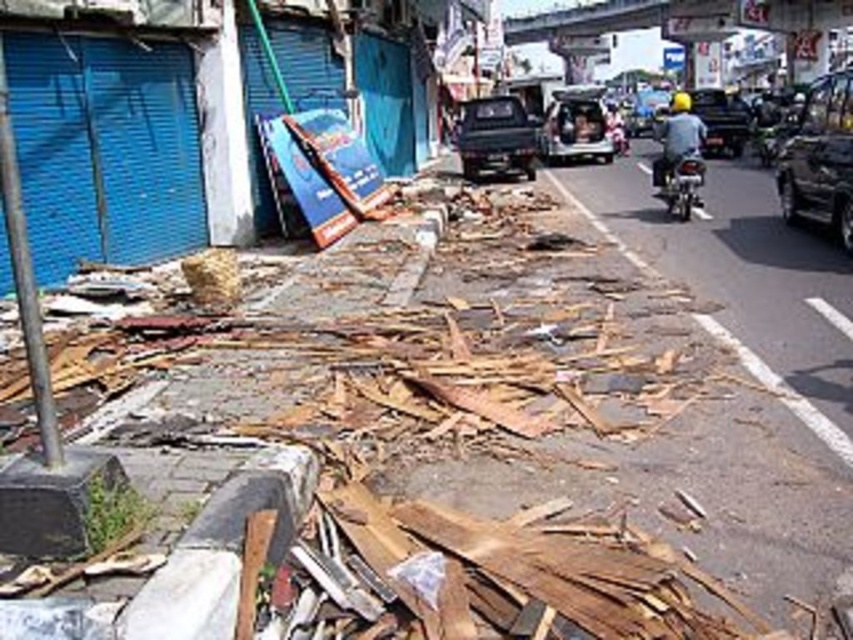
Question: Is metallic gray car at center in front of denim jacket at center?

Choices:
 (A) yes
 (B) no

Answer: (B)

Question: Estimate the real-world distances between objects in this image. Which object is farther from the metallic gray car at center?

Choices:
 (A) metallic silver motorcycle at right
 (B) green matte van at center

Answer: (A)

Question: Is green matte truck at center above metallic silver motorcycle at right?

Choices:
 (A) no
 (B) yes

Answer: (B)

Question: Is green matte van at center thinner than metallic gray car at center?

Choices:
 (A) no
 (B) yes

Answer: (B)

Question: Which object is farther from the camera taking this photo?

Choices:
 (A) green matte truck at center
 (B) denim jacket at center

Answer: (A)

Question: Which of the following is the closest to the observer?

Choices:
 (A) (558, 99)
 (B) (509, 113)
 (C) (701, 202)
 (D) (680, 134)

Answer: (D)